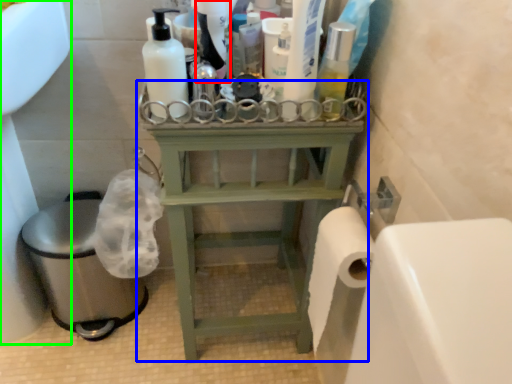
Question: Which is nearer to the cleaning product (highlighted by a red box)? furniture (highlighted by a blue box) or sink (highlighted by a green box).

Choices:
 (A) furniture
 (B) sink

Answer: (A)